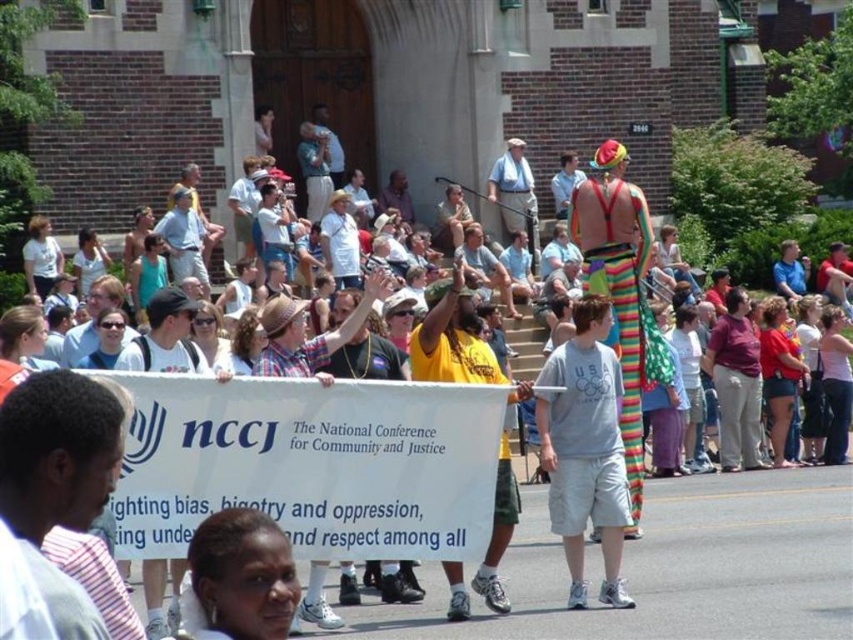
You are a photographer trying to capture a clear photo of the yellow shirt at center and the rainbow striped stilts at center. Since you want both subjects in focus, you need to know which one is wider. Which object is wider?

The rainbow striped stilts at center are wider than the yellow shirt at center, as their width surpasses the yellow shirt at center.